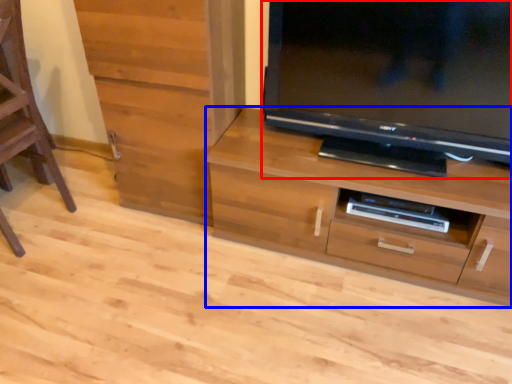
Question: Which of the following is the closest to the observer, television (highlighted by a red box) or chest of drawers (highlighted by a blue box)?

Choices:
 (A) television
 (B) chest of drawers

Answer: (A)